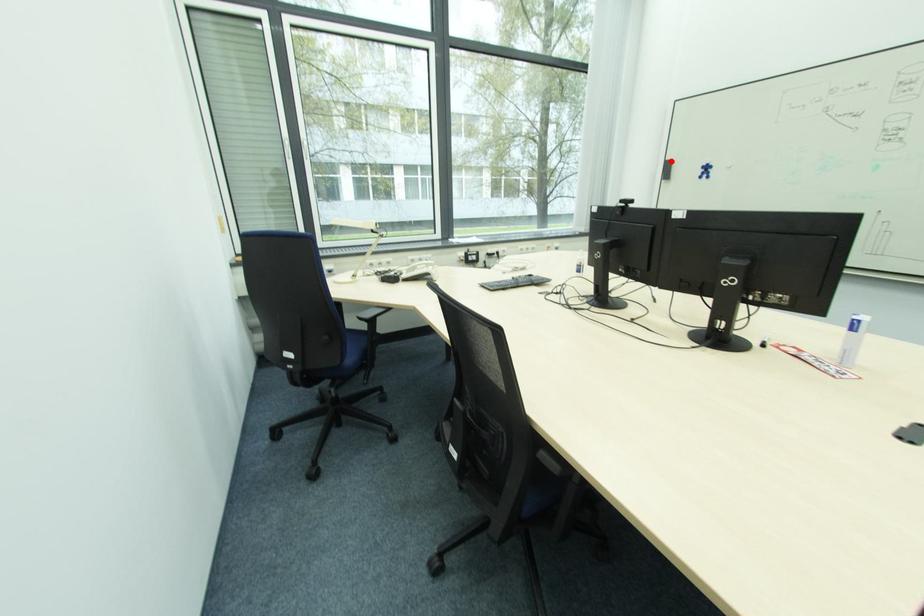
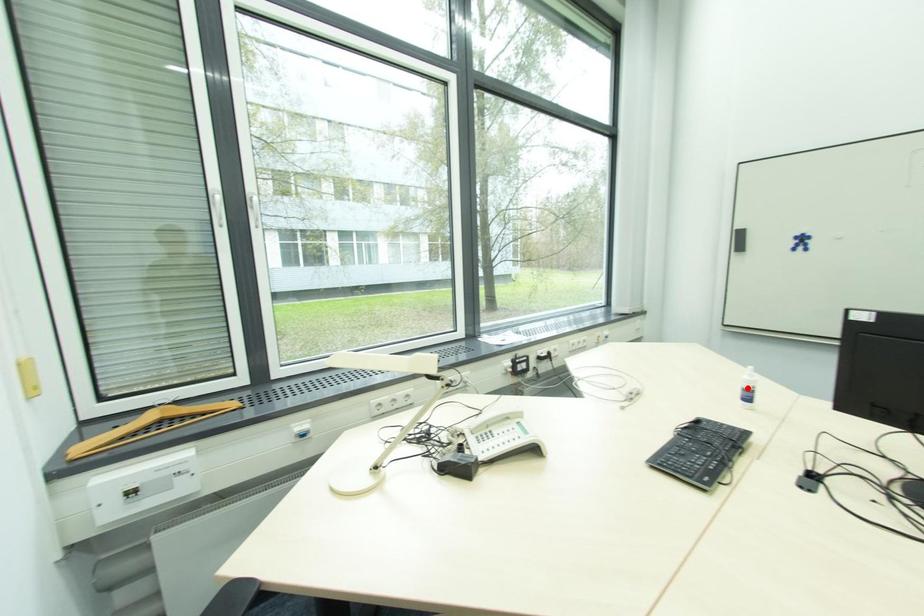
I am providing you with two images of the same scene from different viewpoints. A red point is marked on the first image and another point is marked on the second image. Is the red point in image1 aligned with the point shown in image2?

No